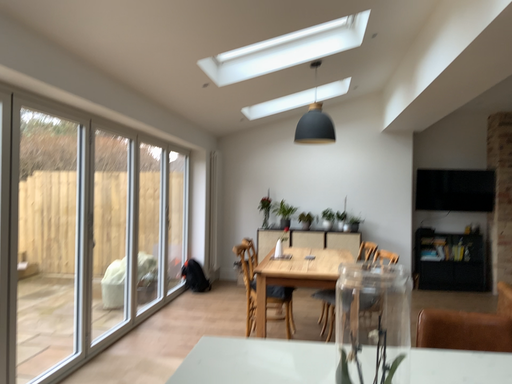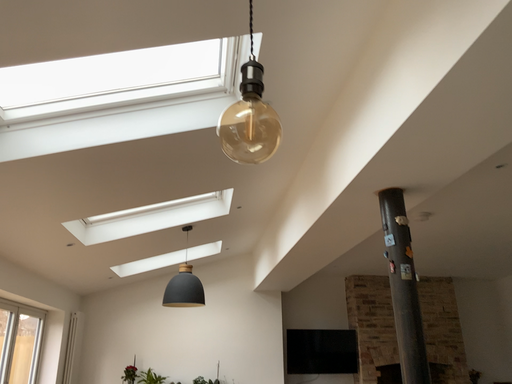
Question: Which way did the camera rotate in the video?

Choices:
 (A) rotated left
 (B) rotated right

Answer: (B)